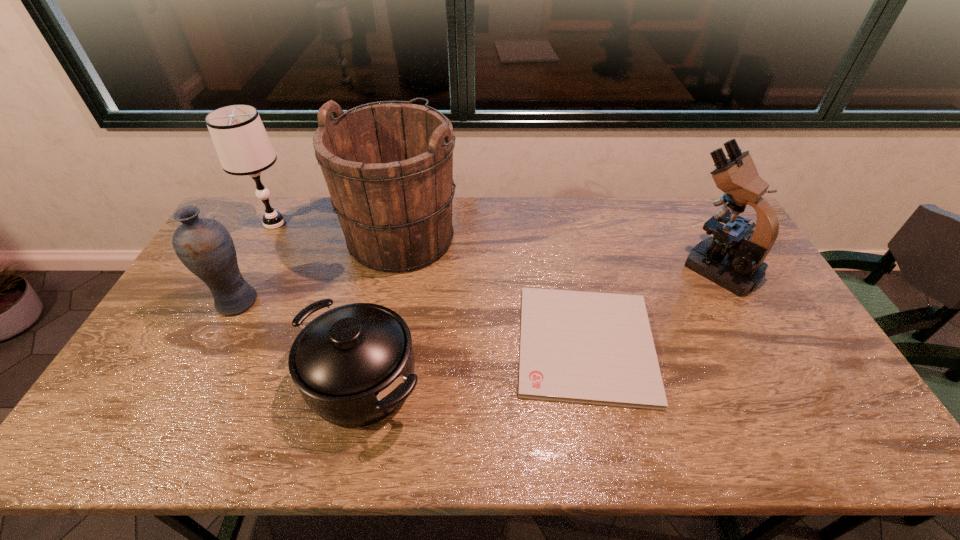
Identify the location of bucket. This screenshot has width=960, height=540. (388, 165).

Find the location of a particular element. table lamp is located at coordinates (242, 144).

Image resolution: width=960 pixels, height=540 pixels. What are the coordinates of `microscope` in the screenshot? It's located at (733, 258).

The width and height of the screenshot is (960, 540). I want to click on the third shortest object, so [x=204, y=245].

This screenshot has width=960, height=540. What are the coordinates of `the second shortest object` in the screenshot? It's located at (354, 365).

This screenshot has height=540, width=960. What are the coordinates of `the fifth object from left to right` in the screenshot? It's located at (586, 347).

Where is `the shortest object`? Image resolution: width=960 pixels, height=540 pixels. the shortest object is located at coordinates pos(586,347).

This screenshot has height=540, width=960. Find the location of `free point located 0.200m on the left of the bucket`. free point located 0.200m on the left of the bucket is located at coordinates (286, 236).

What are the coordinates of `free location located 0.170m on the front of the table lamp` in the screenshot? It's located at (249, 272).

What are the coordinates of `vacant region located 0.060m on the left of the microscope` in the screenshot? It's located at (660, 266).